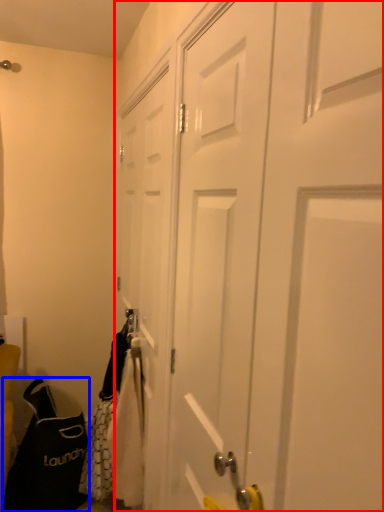
Question: Among these objects, which one is nearest to the camera, door (highlighted by a red box) or shoulder bag (highlighted by a blue box)?

Choices:
 (A) door
 (B) shoulder bag

Answer: (A)